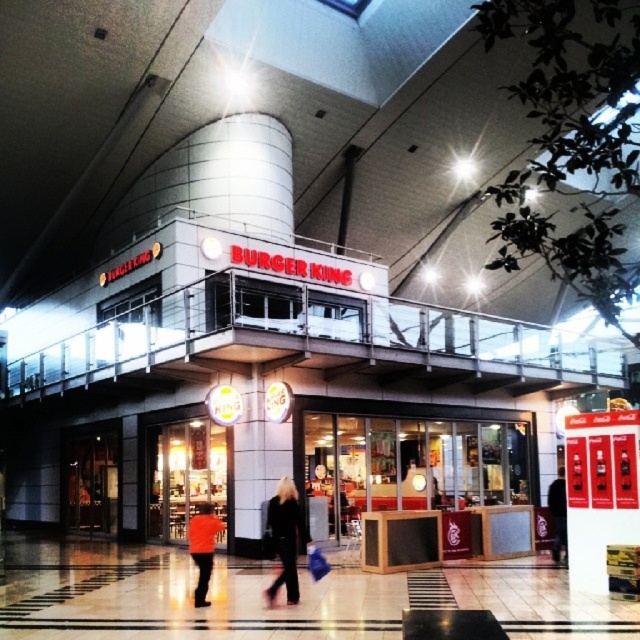
Question: Which object is farther from the camera taking this photo?

Choices:
 (A) black leather jacket at center
 (B) orange fabric jacket at lower center
 (C) black fabric jacket at center

Answer: (C)

Question: Which of the following is the closest to the observer?

Choices:
 (A) (557, 504)
 (B) (193, 595)
 (C) (291, 577)

Answer: (C)

Question: Is orange fabric jacket at lower center to the left of black fabric jacket at center from the viewer's perspective?

Choices:
 (A) yes
 (B) no

Answer: (A)

Question: Considering the relative positions of black leather jacket at center and orange fabric jacket at lower center in the image provided, where is black leather jacket at center located with respect to orange fabric jacket at lower center?

Choices:
 (A) left
 (B) right

Answer: (B)

Question: Is orange fabric jacket at lower center to the left of black fabric jacket at center from the viewer's perspective?

Choices:
 (A) yes
 (B) no

Answer: (A)

Question: Which object is positioned farthest from the orange fabric jacket at lower center?

Choices:
 (A) black leather jacket at center
 (B) black fabric jacket at center

Answer: (B)